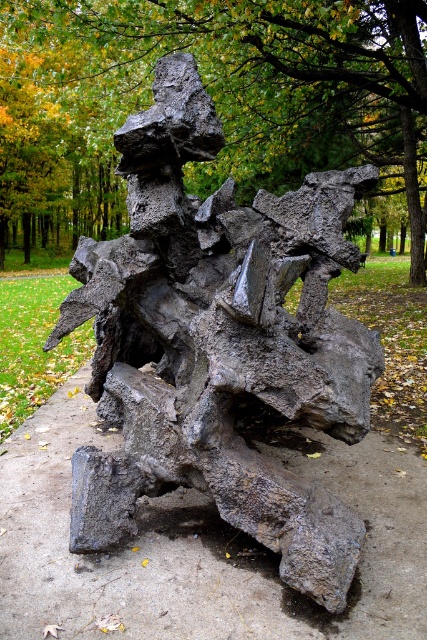
Which of these two, green leafy tree at upper center or rusty metallic sculpture at center, stands taller?

green leafy tree at upper center is taller.

Does green leafy tree at upper center have a larger size compared to rusty metallic sculpture at center?

Indeed, green leafy tree at upper center has a larger size compared to rusty metallic sculpture at center.

This screenshot has width=427, height=640. What do you see at coordinates (213, 93) in the screenshot?
I see `green leafy tree at upper center` at bounding box center [213, 93].

What are the coordinates of `green leafy tree at upper center` in the screenshot? It's located at (213, 93).

Where is `rusty metal sculpture at center`? rusty metal sculpture at center is located at coordinates (219, 342).

Between point (259, 368) and point (354, 77), which one is positioned in front?

Point (259, 368) is more forward.

Identify the location of rusty metal sculpture at center. (219, 342).

Identify the location of rusty metal sculpture at center. Image resolution: width=427 pixels, height=640 pixels. (219, 342).

Is rusty metal sculpture at center further to the viewer compared to rusty metallic sculpture at center?

Yes, it is behind rusty metallic sculpture at center.

Which is in front, point (353, 195) or point (199, 564)?

Point (199, 564) is in front.

This screenshot has height=640, width=427. What do you see at coordinates (219, 342) in the screenshot?
I see `rusty metal sculpture at center` at bounding box center [219, 342].

You are a GUI agent. You are given a task and a screenshot of the screen. Output one action in this format:
    pyautogui.click(x=<x>, y=<y>)
    Task: Click on the rusty metal sculpture at center
    This screenshot has width=427, height=640.
    Given the screenshot: What is the action you would take?
    pyautogui.click(x=219, y=342)